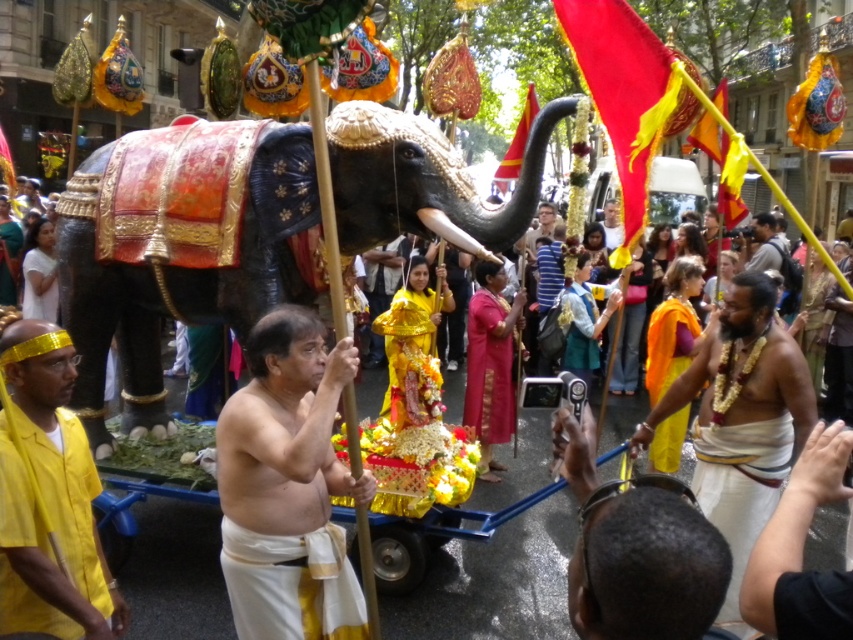
You are standing in the crowd watching the festival procession. There is a point at coordinates (666, 344). What object is this point located on?

The point at (666, 344) is located on the orange silk sari at right.

You are a photographer standing at the front of the procession. You want to capture a photo that includes both the orange silk sari at right and the light brown skin at center. Given that your camera has a maximum focus range of 6 meters, will you be able to include both subjects in the same frame without moving closer?

The distance between the orange silk sari at right and the light brown skin at center is 6.21 meters. Since your camera can only focus up to 6 meters, you won cannot include both subjects in the same frame without moving closer.

Consider the image. You are a photographer standing at the center of the scene. You want to take a photo of the gold beaded necklace at center and the light brown skin at center. The camera you are using has a maximum focus range of 30 feet. Will you be able to capture both subjects clearly in the same photo?

The gold beaded necklace at center is 31.49 feet away from light brown skin at center. Since the distance between them exceeds the camera maximum focus range of 30 feet, you won not be able to capture both clearly in the same photo.